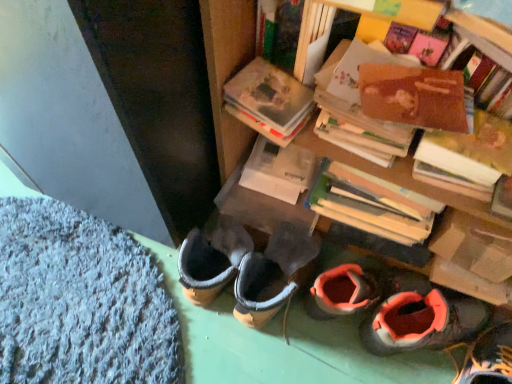
Question: Can you confirm if white matte book at center is positioned to the left of orange suede shoes at lower right, the 1th footwear in the left-to-right sequence?

Choices:
 (A) no
 (B) yes

Answer: (B)

Question: Is white matte book at center in front of orange suede shoes at lower right, the 1th footwear in the left-to-right sequence?

Choices:
 (A) no
 (B) yes

Answer: (A)

Question: Is white matte book at center beside orange suede shoes at lower right, acting as the 2th footwear starting from the right?

Choices:
 (A) no
 (B) yes

Answer: (A)

Question: Is orange suede shoes at lower right, acting as the 2th footwear starting from the right, at the back of white matte book at center?

Choices:
 (A) no
 (B) yes

Answer: (A)

Question: Does white matte book at center have a larger size compared to orange suede shoes at lower right, acting as the 2th footwear starting from the right?

Choices:
 (A) yes
 (B) no

Answer: (B)

Question: Is white matte book at center completely or partially outside of orange suede shoes at lower right, acting as the 2th footwear starting from the right?

Choices:
 (A) yes
 (B) no

Answer: (A)

Question: Does wooden bookshelf at upper right have a larger size compared to white matte book at center?

Choices:
 (A) yes
 (B) no

Answer: (A)

Question: Is the position of wooden bookshelf at upper right less distant than that of white matte book at center?

Choices:
 (A) no
 (B) yes

Answer: (B)

Question: From a real-world perspective, is wooden bookshelf at upper right physically above white matte book at center?

Choices:
 (A) no
 (B) yes

Answer: (B)

Question: From the image's perspective, is wooden bookshelf at upper right beneath white matte book at center?

Choices:
 (A) yes
 (B) no

Answer: (B)

Question: Does wooden bookshelf at upper right have a lesser height compared to white matte book at center?

Choices:
 (A) no
 (B) yes

Answer: (A)

Question: From the image's perspective, does wooden bookshelf at upper right appear higher than white matte book at center?

Choices:
 (A) yes
 (B) no

Answer: (A)

Question: Is brown cardboard book at upper right, the 2th book when ordered from left to right, oriented away from wooden bookshelf at upper right?

Choices:
 (A) yes
 (B) no

Answer: (B)